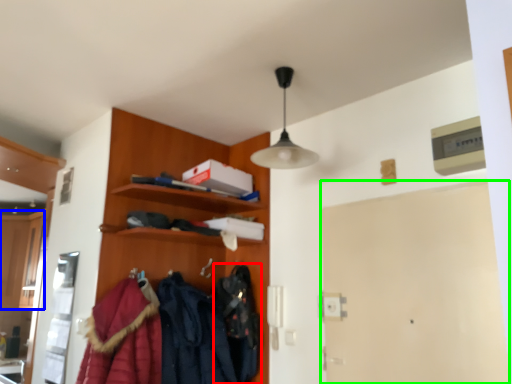
Question: Estimate the real-world distances between objects in this image. Which object is closer to clothing (highlighted by a red box), cabinetry (highlighted by a blue box) or door (highlighted by a green box)?

Choices:
 (A) cabinetry
 (B) door

Answer: (B)